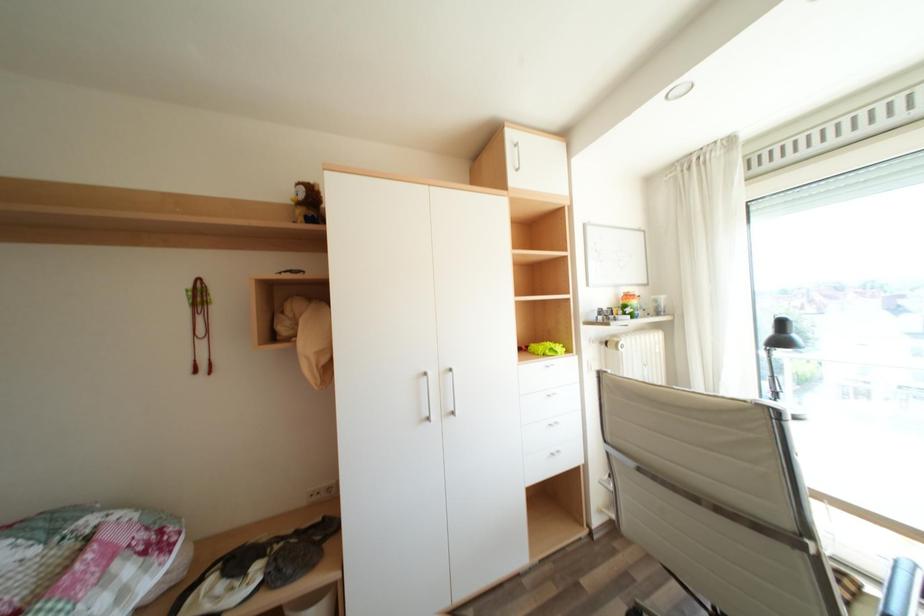
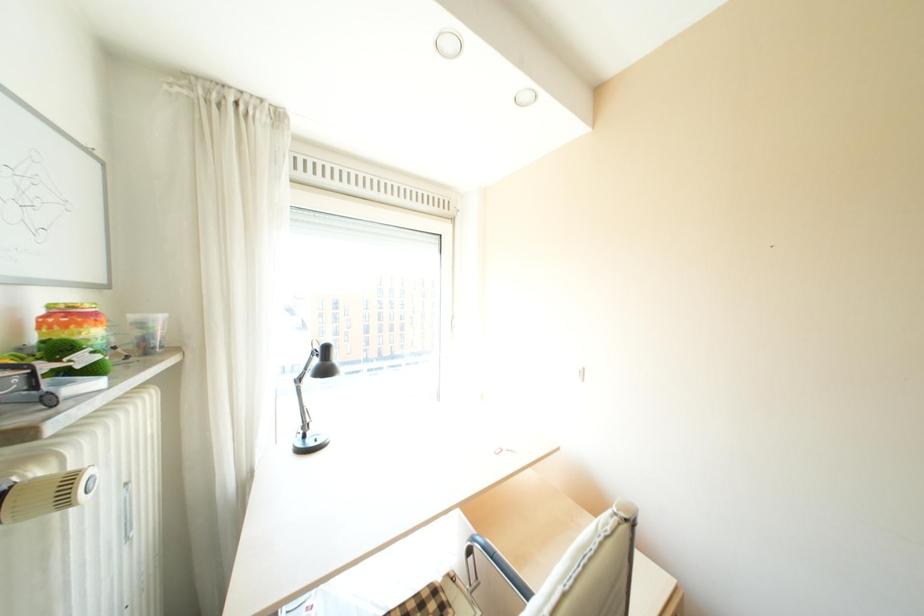
Question: How did the camera likely rotate?

Choices:
 (A) Left
 (B) Right
 (C) Up
 (D) Down

Answer: (B)